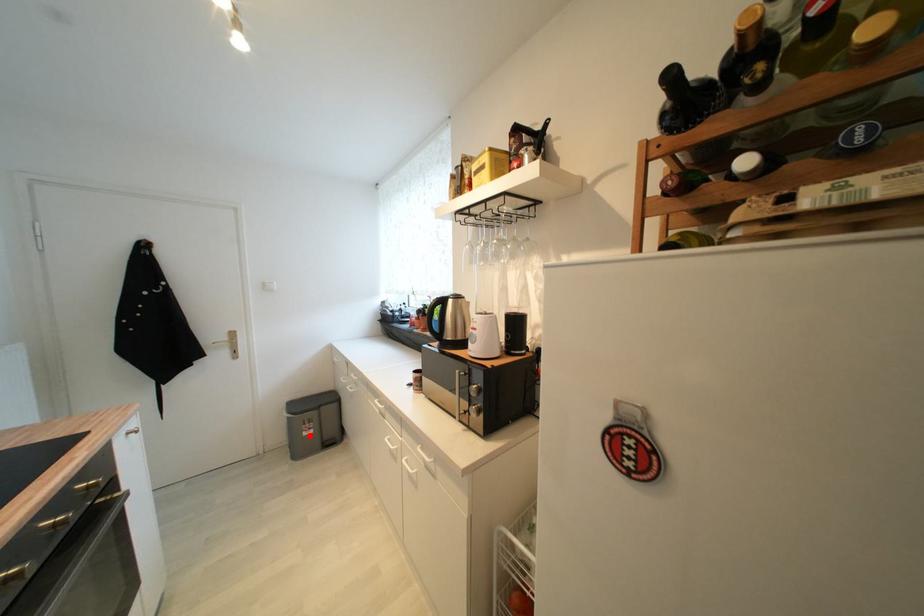
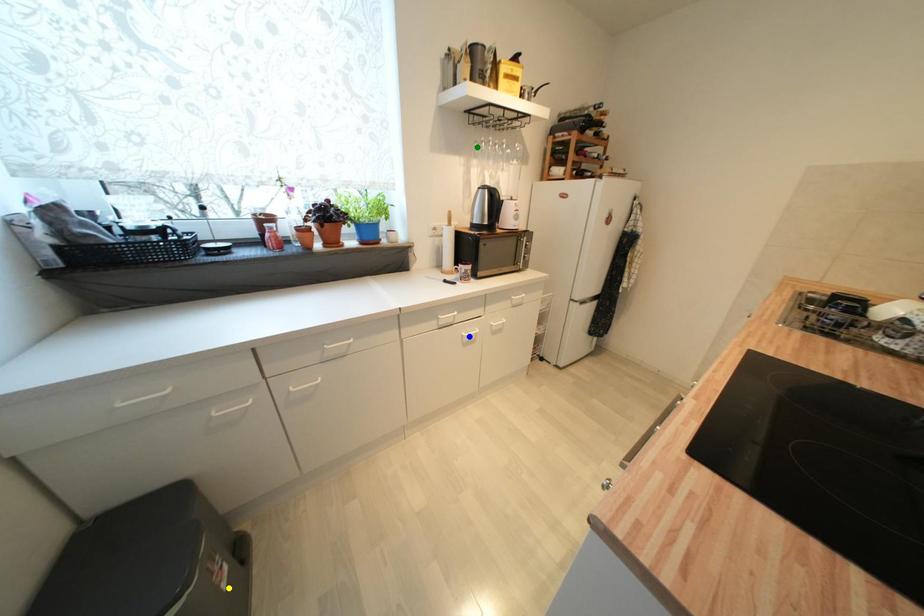
Question: I am providing you with two images of the same scene from different viewpoints. A red point is marked on the first image. You are given multiple points on the second image. Which point in image 2 represents the same 3d spot as the red point in image 1?

Choices:
 (A) yellow point
 (B) blue point
 (C) green point

Answer: (A)